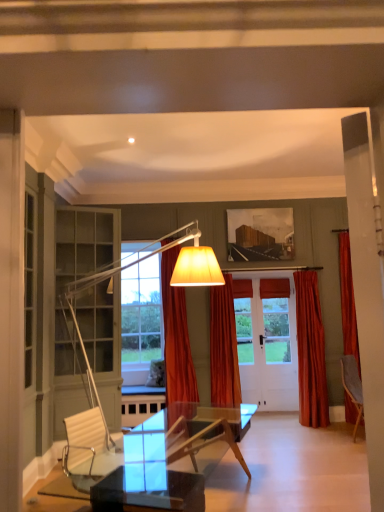
Question: In the image, is velvet orange curtain at right, the 1th curtain viewed from the right, positioned in front of or behind orange velvet curtain at center, marked as the third curtain in a right-to-left arrangement?

Choices:
 (A) behind
 (B) front

Answer: (A)

Question: Considering the positions of velvet orange curtain at right, the 1th curtain viewed from the right, and orange velvet curtain at center, marked as the third curtain in a right-to-left arrangement, in the image, is velvet orange curtain at right, the 1th curtain viewed from the right, taller or shorter than orange velvet curtain at center, marked as the third curtain in a right-to-left arrangement,?

Choices:
 (A) short
 (B) tall

Answer: (A)

Question: Which object is the farthest from the orange velvet curtain at center, which ranks as the second curtain in left-to-right order?

Choices:
 (A) orange velvet curtain at center, marked as the third curtain in a right-to-left arrangement
 (B) velvet orange curtain at right, the 1th curtain viewed from the right

Answer: (B)

Question: Considering the real-world distances, which object is closest to the orange velvet curtain at center, marked as the third curtain in a right-to-left arrangement?

Choices:
 (A) velvet orange curtain at right, the 1th curtain viewed from the right
 (B) orange velvet curtain at center, which ranks as the second curtain in left-to-right order

Answer: (B)